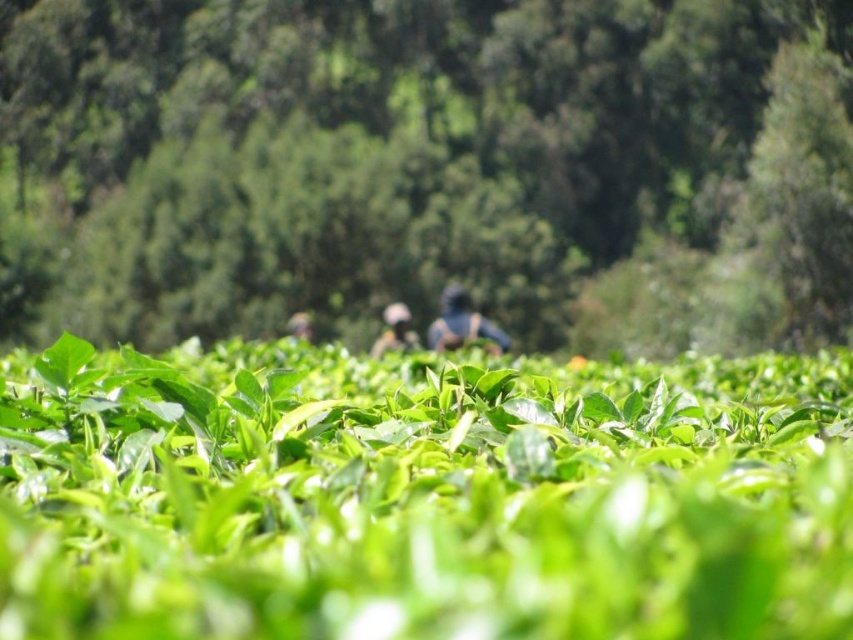
Who is lower down, green leafy plant at center or blue fabric at center?

blue fabric at center

Based on the photo, how far apart are green leafy plant at center and blue fabric at center?

They are 13.96 meters apart.

Find the location of a particular element. The height and width of the screenshot is (640, 853). green leafy plant at center is located at coordinates (428, 168).

Who is taller, green leafy field at center or blue fabric at center?

Standing taller between the two is blue fabric at center.

Which is more to the right, green leafy field at center or blue fabric at center?

Positioned to the right is green leafy field at center.

Locate an element on the screen. The height and width of the screenshot is (640, 853). green leafy field at center is located at coordinates (421, 493).

Between green leafy field at center and matte blue shirt at center, which one appears on the left side from the viewer's perspective?

matte blue shirt at center is more to the left.

Which is behind, point (399, 477) or point (376, 349)?

The point (376, 349) is behind.

Is point (357, 385) positioned in front of point (383, 310)?

Yes, point (357, 385) is closer to viewer.

The width and height of the screenshot is (853, 640). Identify the location of green leafy field at center. (421, 493).